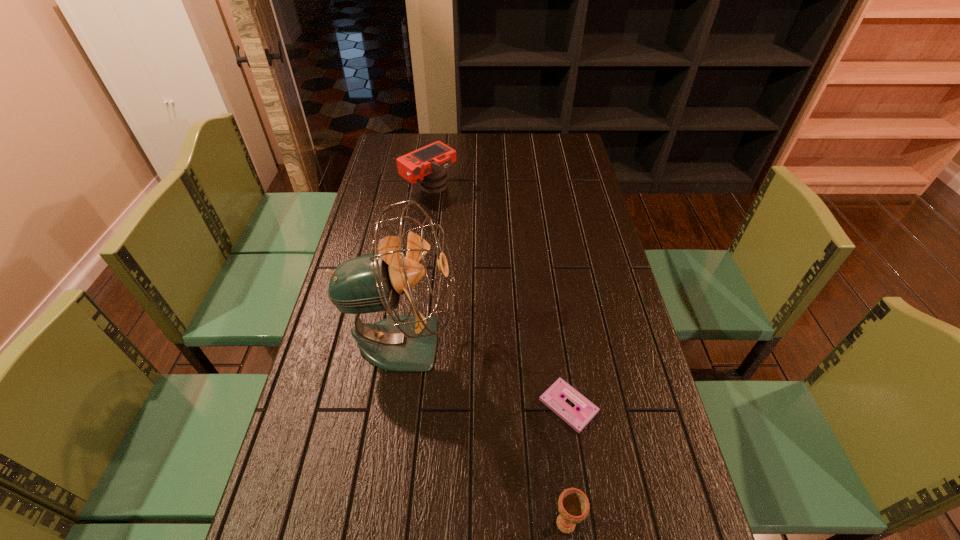
Where is `fan`? This screenshot has height=540, width=960. fan is located at coordinates (370, 283).

Where is `the third shortest object`? the third shortest object is located at coordinates (429, 164).

At what (x,y) coordinates should I click in order to perform the action: click on the farthest object. Please return your answer as a coordinate pair (x, y). The height and width of the screenshot is (540, 960). Looking at the image, I should click on (429, 164).

Locate an element on the screen. Image resolution: width=960 pixels, height=540 pixels. chalice is located at coordinates (573, 505).

The image size is (960, 540). In order to click on the nearest object in this screenshot , I will do `click(573, 505)`.

I want to click on the shortest object, so click(x=552, y=397).

In order to click on free region located 0.180m on the front-facing side of the tallest object for air flow in this screenshot , I will do `click(525, 342)`.

Image resolution: width=960 pixels, height=540 pixels. What are the coordinates of `blank space located on the back of the camera` in the screenshot? It's located at (435, 146).

Identify the location of free space located on the back of the chalice. (555, 433).

Find the location of a particular element. blank space located 0.300m on the back of the shortest object is located at coordinates (551, 292).